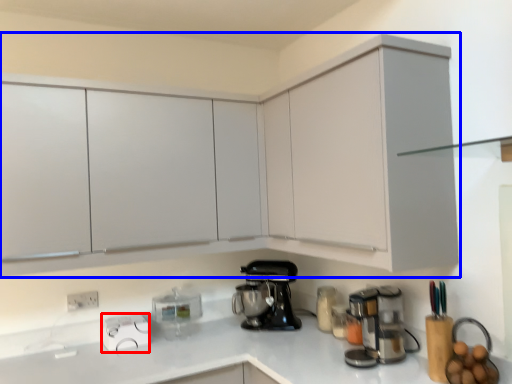
Question: Which object appears closest to the camera in this image, appliance (highlighted by a red box) or cabinetry (highlighted by a blue box)?

Choices:
 (A) appliance
 (B) cabinetry

Answer: (B)